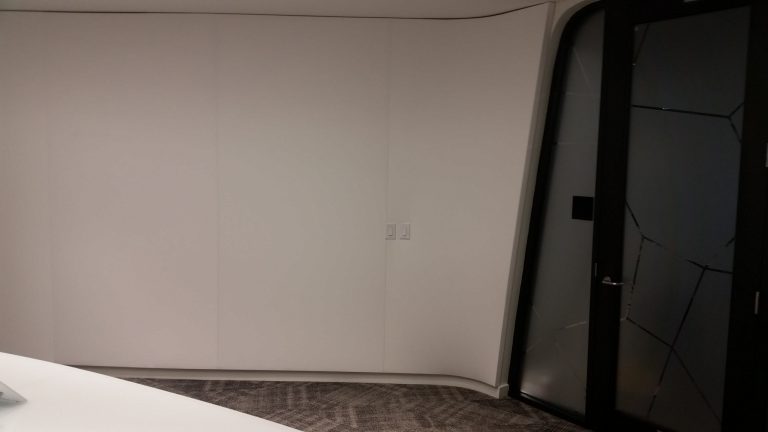
Image resolution: width=768 pixels, height=432 pixels. I want to click on molding, so click(x=468, y=384).